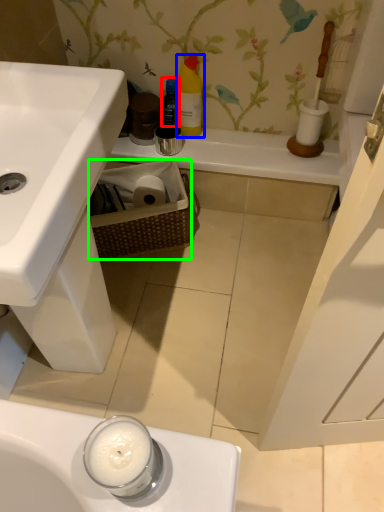
Question: Which object is positioned farthest from bottle (highlighted by a red box)? Select from cleaning product (highlighted by a blue box) and basket (highlighted by a green box).

Choices:
 (A) cleaning product
 (B) basket

Answer: (B)